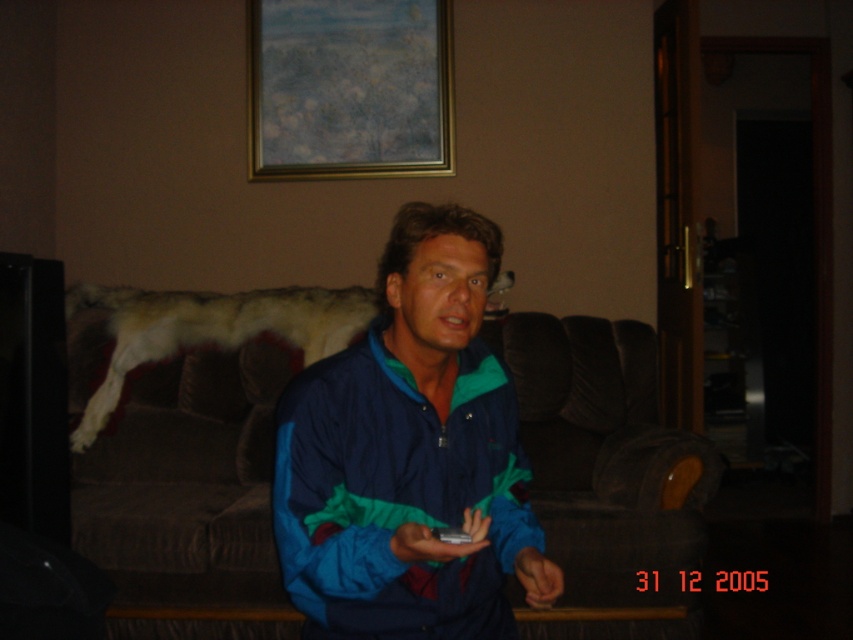
Question: Is blue/green fabric jacket at center below gold metallic picture frame at upper center?

Choices:
 (A) no
 (B) yes

Answer: (B)

Question: Does blue/green fabric jacket at center appear on the left side of gold metallic picture frame at upper center?

Choices:
 (A) no
 (B) yes

Answer: (A)

Question: Which point is closer to the camera?

Choices:
 (A) pyautogui.click(x=131, y=560)
 (B) pyautogui.click(x=469, y=321)
 (C) pyautogui.click(x=425, y=68)
 (D) pyautogui.click(x=450, y=538)

Answer: (D)

Question: Among these points, which one is farthest from the camera?

Choices:
 (A) (415, 83)
 (B) (248, 320)

Answer: (A)

Question: Which object is positioned farthest from the gold metallic picture frame at upper center?

Choices:
 (A) black plastic remote at center
 (B) brown fabric couch at center

Answer: (A)

Question: Can you confirm if brown fabric couch at center is thinner than white fur coat at upper left?

Choices:
 (A) no
 (B) yes

Answer: (B)